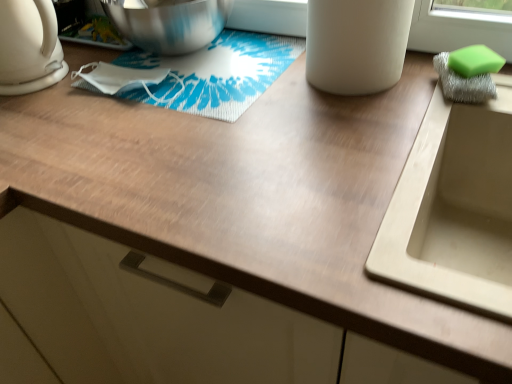
Question: Can you confirm if beige matte sink at right is taller than green sponge at right?

Choices:
 (A) yes
 (B) no

Answer: (A)

Question: Does beige matte sink at right appear on the right side of green sponge at right?

Choices:
 (A) no
 (B) yes

Answer: (A)

Question: Can you confirm if beige matte sink at right is smaller than green sponge at right?

Choices:
 (A) no
 (B) yes

Answer: (A)

Question: Is beige matte sink at right directly adjacent to green sponge at right?

Choices:
 (A) yes
 (B) no

Answer: (B)

Question: Considering the relative sizes of beige matte sink at right and green sponge at right in the image provided, is beige matte sink at right bigger than green sponge at right?

Choices:
 (A) no
 (B) yes

Answer: (B)

Question: Does beige matte sink at right turn towards green sponge at right?

Choices:
 (A) no
 (B) yes

Answer: (A)

Question: Is green sponge at right positioned in front of shiny metallic mixing bowl at upper left?

Choices:
 (A) yes
 (B) no

Answer: (A)

Question: Is green sponge at right surrounding shiny metallic mixing bowl at upper left?

Choices:
 (A) no
 (B) yes

Answer: (A)

Question: Considering the relative sizes of green sponge at right and shiny metallic mixing bowl at upper left in the image provided, is green sponge at right thinner than shiny metallic mixing bowl at upper left?

Choices:
 (A) yes
 (B) no

Answer: (A)

Question: From a real-world perspective, is green sponge at right beneath shiny metallic mixing bowl at upper left?

Choices:
 (A) no
 (B) yes

Answer: (B)

Question: From the image's perspective, is green sponge at right located above shiny metallic mixing bowl at upper left?

Choices:
 (A) yes
 (B) no

Answer: (B)

Question: Is green sponge at right bigger than shiny metallic mixing bowl at upper left?

Choices:
 (A) no
 (B) yes

Answer: (A)

Question: Is white matte cup at upper center wider than green sponge at right?

Choices:
 (A) yes
 (B) no

Answer: (A)